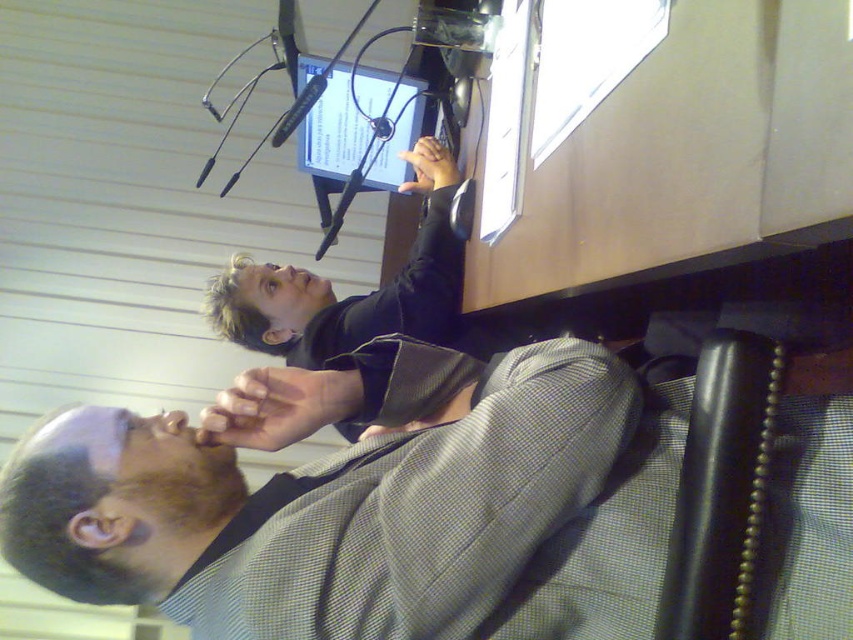
Is matte black jacket at upper center positioned behind matte black monitor at center?

No, matte black jacket at upper center is in front of matte black monitor at center.

Can you confirm if matte black jacket at upper center is positioned to the right of matte black monitor at center?

In fact, matte black jacket at upper center is to the left of matte black monitor at center.

Is point (387, 285) closer to viewer compared to point (318, 68)?

Yes, point (387, 285) is closer to viewer.

I want to click on matte black jacket at upper center, so click(x=352, y=296).